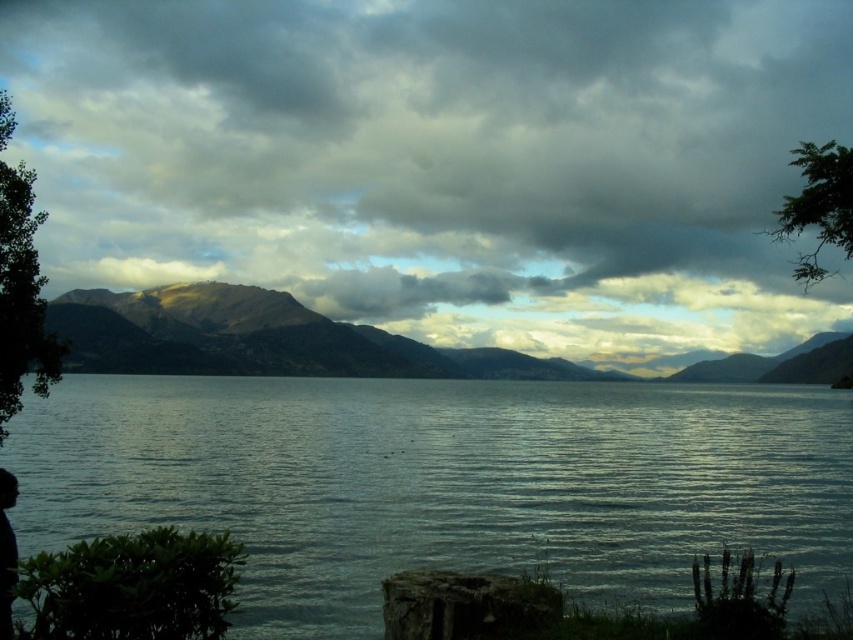
Question: Is smooth water at center bigger than rugged brown mountain at center?

Choices:
 (A) yes
 (B) no

Answer: (B)

Question: Is rugged brown mountain at center behind green leafy tree at upper right?

Choices:
 (A) no
 (B) yes

Answer: (B)

Question: Which point is farther from the camera taking this photo?

Choices:
 (A) [67, 333]
 (B) [22, 216]
 (C) [82, 545]
 (D) [845, 195]

Answer: (A)

Question: Which object appears closest to the camera in this image?

Choices:
 (A) green leafy tree at left
 (B) smooth water at center

Answer: (B)

Question: Which object is closer to the camera taking this photo?

Choices:
 (A) green leafy tree at left
 (B) cloudy sky at upper center
 (C) smooth water at center

Answer: (C)

Question: Considering the relative positions of smooth water at center and green leafy bush at lower left in the image provided, where is smooth water at center located with respect to green leafy bush at lower left?

Choices:
 (A) below
 (B) above

Answer: (A)